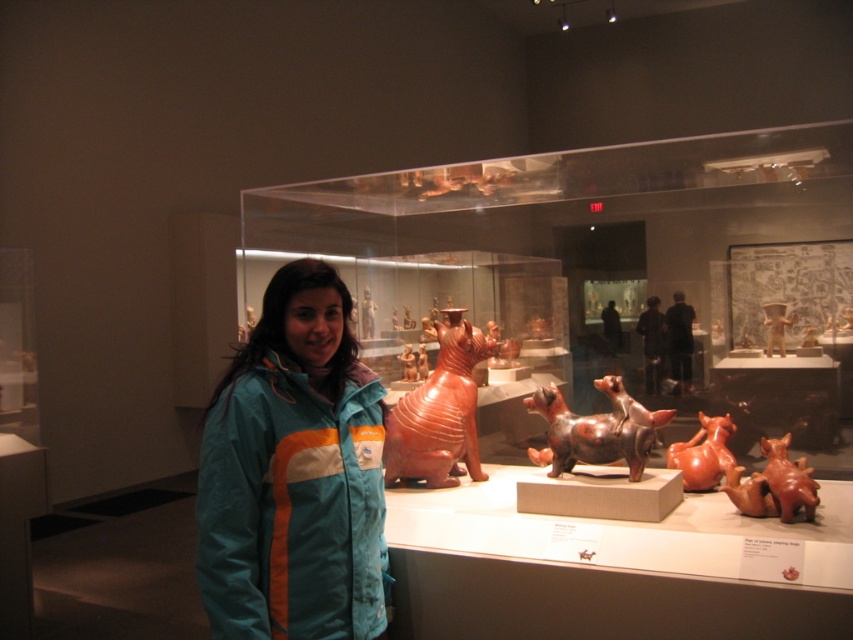
You are a security guard in the museum and need to ensure visitors stay at least 3 feet away from the display case. You see the teal fabric jacket at center and the matte terracotta cat at center. Are they violating the safety distance rule?

The distance between the teal fabric jacket at center and the matte terracotta cat at center is 32.37 inches. Since 3 feet equals 36 inches, the current distance is less than required. Therefore, the visitor is too close and violating the safety rule.

You are a museum visitor who wants to take a photo of both the shiny brown dog at center and the matte orange clay dog at center. Since you want to ensure both are fully visible in the frame, which dog should you focus on to avoid cropping the taller one?

The shiny brown dog at center is taller than the matte orange clay dog at center, so you should focus on the shiny brown dog at center to ensure it fits entirely in the frame without being cropped.

You are standing in the museum and want to take a photo of the display case. You notice two points marked on the floor near the case. Which point, point (341,461) or point (408,419), is closer to you?

Point (341,461) is closer to the viewer than point (408,419).